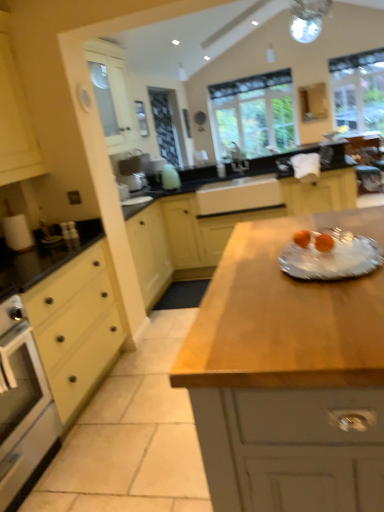
What do you see at coordinates (331, 257) in the screenshot?
I see `clear glass plate at center` at bounding box center [331, 257].

Identify the location of clear glass plate at center. (331, 257).

Image resolution: width=384 pixels, height=512 pixels. What do you see at coordinates (358, 90) in the screenshot?
I see `clear glass window at upper right, which ranks as the 1th window in right-to-left order` at bounding box center [358, 90].

What do you see at coordinates (240, 196) in the screenshot? I see `white ceramic sink at center, arranged as the second sink when viewed from the top` at bounding box center [240, 196].

The width and height of the screenshot is (384, 512). What do you see at coordinates (15, 119) in the screenshot? I see `matte yellow cabinet at left` at bounding box center [15, 119].

Where is `white ceramic sink at center, placed as the 1th sink when sorted from top to bottom`? white ceramic sink at center, placed as the 1th sink when sorted from top to bottom is located at coordinates (236, 158).

What do you see at coordinates (288, 376) in the screenshot?
I see `wooden at center, which ranks as the 1th countertop in front-to-back order` at bounding box center [288, 376].

Where is `clear glass plate at center`? The width and height of the screenshot is (384, 512). clear glass plate at center is located at coordinates [331, 257].

Is white ceramic sink at center, arranged as the second sink when viewed from the top, taller or shorter than matte yellow cabinet at left?

In the image, white ceramic sink at center, arranged as the second sink when viewed from the top, appears to be shorter than matte yellow cabinet at left.

Is white ceramic sink at center, arranged as the second sink when viewed from the top, positioned with its back to matte yellow cabinet at left?

That's not correct — white ceramic sink at center, arranged as the second sink when viewed from the top, is not looking away from matte yellow cabinet at left.

Is white ceramic sink at center, arranged as the second sink when viewed from the top, next to matte yellow cabinet at left and touching it?

white ceramic sink at center, arranged as the second sink when viewed from the top, and matte yellow cabinet at left are not in contact.

Does point (227, 188) come in front of point (25, 174)?

No, it is behind (25, 174).

Considering the relative sizes of clear glass window at center, which ranks as the first window in left-to-right order, and wooden at center, which ranks as the 1th countertop in front-to-back order, in the image provided, is clear glass window at center, which ranks as the first window in left-to-right order, shorter than wooden at center, which ranks as the 1th countertop in front-to-back order,?

No, clear glass window at center, which ranks as the first window in left-to-right order, is not shorter than wooden at center, which ranks as the 1th countertop in front-to-back order.

Can you confirm if clear glass window at center, which is the second window from right to left, is smaller than wooden at center, the second countertop when ordered from back to front?

Correct, clear glass window at center, which is the second window from right to left, occupies less space than wooden at center, the second countertop when ordered from back to front.

Is clear glass window at center, which is the second window from right to left, completely or partially outside of wooden at center, which ranks as the 1th countertop in front-to-back order?

Yes.

Is wooden at center, which ranks as the 1th countertop in front-to-back order, at the back of clear glass window at center, which is the second window from right to left?

clear glass window at center, which is the second window from right to left, does not have its back to wooden at center, which ranks as the 1th countertop in front-to-back order.

Which object is thinner, wooden at center, the second countertop when ordered from back to front, or matte yellow cabinet at left?

matte yellow cabinet at left is thinner.

Could you tell me if wooden at center, which ranks as the 1th countertop in front-to-back order, is facing matte yellow cabinet at left?

No.

At what (x,y) coordinates should I click in order to perform the action: click on the 2nd countertop below the matte yellow cabinet at left (from the image's perspective). Please return your answer as a coordinate pair (x, y). This screenshot has height=512, width=384. Looking at the image, I should click on (288, 376).

Is wooden at center, the second countertop when ordered from back to front, inside the boundaries of matte yellow cabinet at left, or outside?

wooden at center, the second countertop when ordered from back to front, is not inside matte yellow cabinet at left, it's outside.

Considering the relative sizes of white ceramic sink at center, positioned as the second sink in bottom-to-top order, and clear glass window at upper right, positioned as the 2th window in left-to-right order, in the image provided, is white ceramic sink at center, positioned as the second sink in bottom-to-top order, thinner than clear glass window at upper right, positioned as the 2th window in left-to-right order,?

Incorrect, the width of white ceramic sink at center, positioned as the second sink in bottom-to-top order, is not less than that of clear glass window at upper right, positioned as the 2th window in left-to-right order.

Is white ceramic sink at center, positioned as the second sink in bottom-to-top order, beside clear glass window at upper right, which ranks as the 1th window in right-to-left order?

No, white ceramic sink at center, positioned as the second sink in bottom-to-top order, is not next to clear glass window at upper right, which ranks as the 1th window in right-to-left order.

From a real-world perspective, is white ceramic sink at center, placed as the 1th sink when sorted from top to bottom, physically above clear glass window at upper right, positioned as the 2th window in left-to-right order?

No, from a real-world perspective, white ceramic sink at center, placed as the 1th sink when sorted from top to bottom, is not on top of clear glass window at upper right, positioned as the 2th window in left-to-right order.

Is white ceramic sink at center, placed as the 1th sink when sorted from top to bottom, positioned with its back to clear glass window at upper right, which ranks as the 1th window in right-to-left order?

white ceramic sink at center, placed as the 1th sink when sorted from top to bottom, does not have its back to clear glass window at upper right, which ranks as the 1th window in right-to-left order.

What's the angular difference between white ceramic sink at center, positioned as the second sink in bottom-to-top order, and wooden at center, the second countertop when ordered from back to front,'s facing directions?

178 degrees separate the facing orientations of white ceramic sink at center, positioned as the second sink in bottom-to-top order, and wooden at center, the second countertop when ordered from back to front.

You are a GUI agent. You are given a task and a screenshot of the screen. Output one action in this format:
    pyautogui.click(x=<x>, y=<y>)
    Task: Click on the 2nd countertop in front of the white ceramic sink at center, placed as the 1th sink when sorted from top to bottom
    The image size is (384, 512).
    Given the screenshot: What is the action you would take?
    pyautogui.click(x=288, y=376)

Which object is closer to the camera taking this photo, white ceramic sink at center, placed as the 1th sink when sorted from top to bottom, or wooden at center, which ranks as the 1th countertop in front-to-back order?

wooden at center, which ranks as the 1th countertop in front-to-back order, is closer to the camera.

Is point (235, 143) positioned after point (383, 463)?

Yes, point (235, 143) is behind point (383, 463).

From the image's perspective, count 2nd windows upward from the clear glass plate at center and point to it. Please provide its 2D coordinates.

[(358, 90)]

In the scene shown: Is clear glass window at upper right, positioned as the 2th window in left-to-right order, far away from clear glass plate at center?

Yes.

Is clear glass window at upper right, which ranks as the 1th window in right-to-left order, wider than clear glass plate at center?

Incorrect, the width of clear glass window at upper right, which ranks as the 1th window in right-to-left order, does not surpass that of clear glass plate at center.

Considering the relative sizes of clear glass plate at center and black matte countertop at center, arranged as the 2th countertop when viewed from the front, in the image provided, is clear glass plate at center bigger than black matte countertop at center, arranged as the 2th countertop when viewed from the front,?

Incorrect, clear glass plate at center is not larger than black matte countertop at center, arranged as the 2th countertop when viewed from the front.

From the image's perspective, is clear glass plate at center located beneath black matte countertop at center, arranged as the 2th countertop when viewed from the front?

Yes.

Is clear glass plate at center not close to black matte countertop at center, arranged as the 2th countertop when viewed from the front?

Indeed, clear glass plate at center is not near black matte countertop at center, arranged as the 2th countertop when viewed from the front.

This screenshot has width=384, height=512. I want to click on sink that is the 2nd object directly below the matte yellow cabinet at left (from a real-world perspective), so click(240, 196).

Which window is the 2nd one when counting from the back of the wooden at center, which ranks as the 1th countertop in front-to-back order? Please provide its 2D coordinates.

[(255, 113)]

Which object lies nearer to the anchor point clear glass window at center, which is the second window from right to left, clear glass plate at center or white ceramic sink at center, the 1th sink positioned from the bottom?

white ceramic sink at center, the 1th sink positioned from the bottom, is closer to clear glass window at center, which is the second window from right to left.

Considering their positions, is clear glass window at center, which ranks as the first window in left-to-right order, positioned closer to black matte countertop at center, arranged as the 2th countertop when viewed from the front, than yellow matte drawer at left?

yellow matte drawer at left.

In the scene shown: Estimate the real-world distances between objects in this image. Which object is further from clear glass window at center, which ranks as the first window in left-to-right order, wooden at center, the second countertop when ordered from back to front, or yellow matte drawer at left?

The object further to clear glass window at center, which ranks as the first window in left-to-right order, is wooden at center, the second countertop when ordered from back to front.

From the image, which object appears to be nearer to yellow matte drawer at left, clear glass window at upper right, which ranks as the 1th window in right-to-left order, or white ceramic sink at center, positioned as the second sink in bottom-to-top order?

white ceramic sink at center, positioned as the second sink in bottom-to-top order, lies closer to yellow matte drawer at left than the other object.

Looking at the image, which one is located further to clear glass plate at center, clear glass window at upper right, positioned as the 2th window in left-to-right order, or wooden at center, which ranks as the 1th countertop in front-to-back order?

clear glass window at upper right, positioned as the 2th window in left-to-right order, is positioned further to the anchor clear glass plate at center.

Looking at the image, which one is located further to white ceramic sink at center, arranged as the second sink when viewed from the top, clear glass window at center, which ranks as the first window in left-to-right order, or clear glass window at upper right, positioned as the 2th window in left-to-right order?

Based on the image, clear glass window at upper right, positioned as the 2th window in left-to-right order, appears to be further to white ceramic sink at center, arranged as the second sink when viewed from the top.

Looking at the image, which one is located further to black matte countertop at center, arranged as the 2th countertop when viewed from the front, wooden at center, the second countertop when ordered from back to front, or matte yellow cabinet at left?

Based on the image, wooden at center, the second countertop when ordered from back to front, appears to be further to black matte countertop at center, arranged as the 2th countertop when viewed from the front.

When comparing their distances from black matte countertop at center, marked as the first countertop in a back-to-front arrangement, does yellow matte drawer at left or matte yellow cabinet at left seem closer?

The object closer to black matte countertop at center, marked as the first countertop in a back-to-front arrangement, is yellow matte drawer at left.

Identify the location of countertop between matte yellow cabinet at left and white ceramic sink at center, positioned as the second sink in bottom-to-top order, from front to back. (215, 227).

The width and height of the screenshot is (384, 512). In order to click on countertop between yellow matte drawer at left and clear glass window at center, which ranks as the first window in left-to-right order, from front to back in this screenshot , I will do `click(215, 227)`.

Image resolution: width=384 pixels, height=512 pixels. Find the location of `drawer located between wooden at center, which ranks as the 1th countertop in front-to-back order, and clear glass window at center, which ranks as the first window in left-to-right order, in the depth direction`. drawer located between wooden at center, which ranks as the 1th countertop in front-to-back order, and clear glass window at center, which ranks as the first window in left-to-right order, in the depth direction is located at coordinates (76, 326).

Where is `drawer located between matte yellow cabinet at left and white ceramic sink at center, arranged as the second sink when viewed from the top, in the depth direction`? The image size is (384, 512). drawer located between matte yellow cabinet at left and white ceramic sink at center, arranged as the second sink when viewed from the top, in the depth direction is located at coordinates (76, 326).